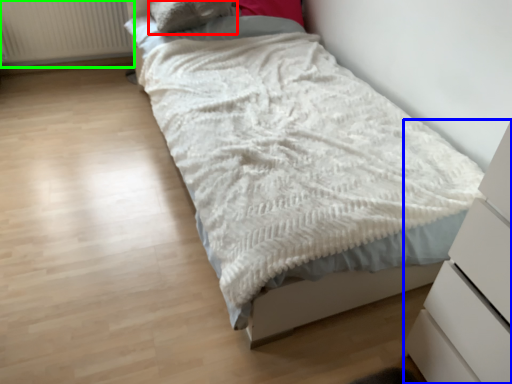
Question: Estimate the real-world distances between objects in this image. Which object is farther from pillow (highlighted by a red box), chest of drawers (highlighted by a blue box) or radiator (highlighted by a green box)?

Choices:
 (A) chest of drawers
 (B) radiator

Answer: (A)